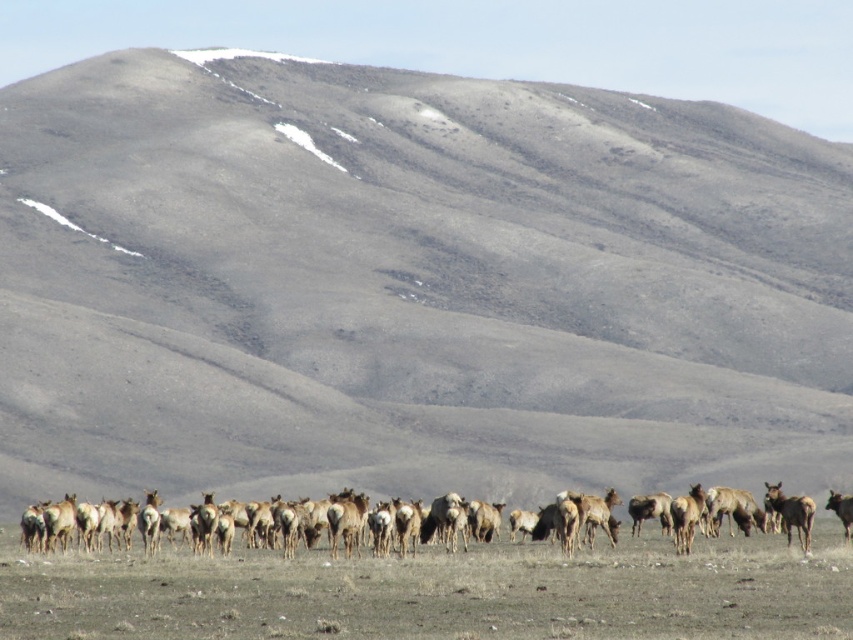
You are an explorer navigating a vast open landscape with a herd of elk grazing in the foreground. You see two points marked on your map at coordinates point (838,584) and point (846,525). Which point is closer to you from your current position?

A: Point (838,584) is in front of point (846,525), so it is closer to you.

You are a wildlife photographer aiming to capture the entire herd of brown fur herd at lower center and the brown furry elk at center in a single frame. Given that your camera can only fit objects of equal width in the shot, will you be able to do so?

The brown fur herd at lower center is wider than the brown furry elk at center, so they are not of equal width. Therefore, you cannot capture both in a single frame if your camera requires objects to be of equal width.

You are an ecologist observing the landscape. You need to determine which object is nearer to you between the brown textured grassland at center and the brown furry elk at center. Which one is closer?

The brown textured grassland at center is closer to the viewer than the brown furry elk at center.